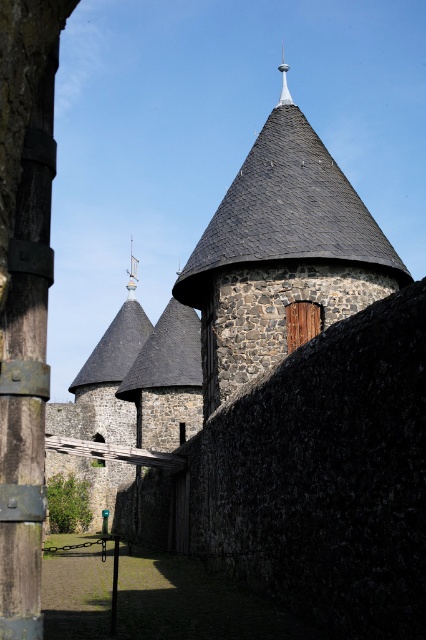
You are a tourist visiting the medieval castle. You notice the dark gray stone tower at center and the shiny silver spire at center. Which object is closer to you?

The dark gray stone tower at center is closer to you because it is in front of the shiny silver spire at center.

You are standing in front of the medieval stone structure and want to take a photo. You notice two points marked in the scene. Which point, point (354, 225) or point (285, 88), is closer to you?

Point (354, 225) is closer to you than point (285, 88).

You are a medieval architect designing a scale model of this structure. You need to ensure the dark gray stone tower at center and the silver metallic spire at upper center are proportionally accurate. Which object should have a wider base in your model?

The silver metallic spire at upper center should have a wider base in the model since its actual width is greater than the dark gray stone tower at center.